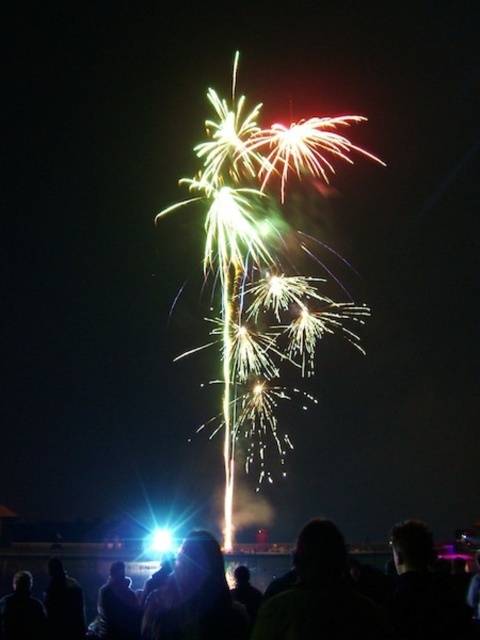
Can you confirm if black matte crowd at lower center is smaller than black matte person at lower center?

Incorrect, black matte crowd at lower center is not smaller in size than black matte person at lower center.

Is black matte crowd at lower center wider than black matte person at lower center?

Indeed, black matte crowd at lower center has a greater width compared to black matte person at lower center.

Is point (90, 552) behind point (229, 627)?

Yes, point (90, 552) is behind point (229, 627).

The image size is (480, 640). In order to click on black matte crowd at lower center in this screenshot , I will do `click(70, 564)`.